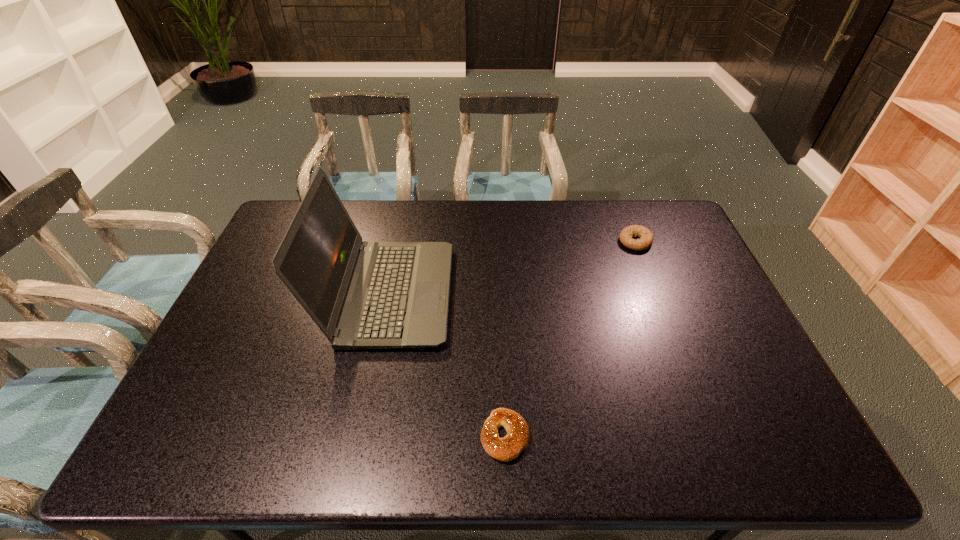
Where is `vacant point that satisfies the following two spatial constraints: 1. on the screen of the nearest object; 2. on the left side of the tallest object`? Image resolution: width=960 pixels, height=540 pixels. vacant point that satisfies the following two spatial constraints: 1. on the screen of the nearest object; 2. on the left side of the tallest object is located at coordinates (359, 436).

Image resolution: width=960 pixels, height=540 pixels. Find the location of `free location that satisfies the following two spatial constraints: 1. on the screen of the second object from right to left; 2. on the left side of the tallest object`. free location that satisfies the following two spatial constraints: 1. on the screen of the second object from right to left; 2. on the left side of the tallest object is located at coordinates (359, 436).

Find the location of a particular element. This screenshot has width=960, height=540. vacant point that satisfies the following two spatial constraints: 1. on the back side of the right bagel; 2. on the right side of the second object from right to left is located at coordinates (496, 241).

You are a GUI agent. You are given a task and a screenshot of the screen. Output one action in this format:
    pyautogui.click(x=<x>, y=<y>)
    Task: Click on the vacant region that satisfies the following two spatial constraints: 1. on the back side of the left bagel; 2. on the left side of the rightmost object
    
    Given the screenshot: What is the action you would take?
    pyautogui.click(x=496, y=241)

This screenshot has height=540, width=960. I want to click on blank space that satisfies the following two spatial constraints: 1. on the screen of the nearer bagel; 2. on the left side of the leftmost object, so 359,436.

Locate an element on the screen. This screenshot has height=540, width=960. free space in the image that satisfies the following two spatial constraints: 1. on the screen of the leftmost object; 2. on the back side of the nearer bagel is located at coordinates (359, 436).

Where is `blank space that satisfies the following two spatial constraints: 1. on the screen of the nearest object; 2. on the left side of the tallest object`? This screenshot has width=960, height=540. blank space that satisfies the following two spatial constraints: 1. on the screen of the nearest object; 2. on the left side of the tallest object is located at coordinates (359, 436).